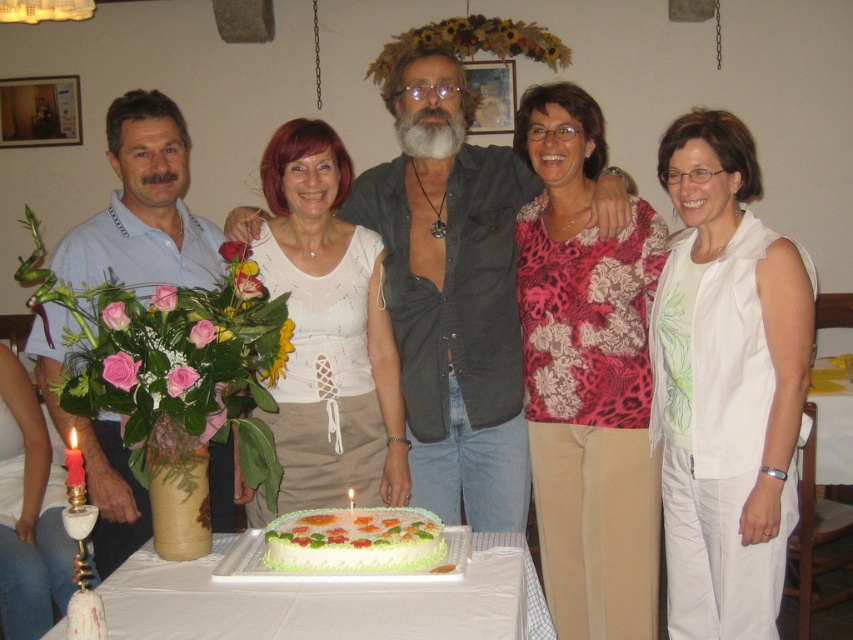
Question: Among these objects, which one is nearest to the camera?

Choices:
 (A) matte light blue polo shirt at left
 (B) dark gray shirt at center
 (C) white cotton vest at center

Answer: (A)

Question: Is white lace top at center below matte light blue polo shirt at left?

Choices:
 (A) yes
 (B) no

Answer: (B)

Question: Does white lace top at center have a smaller size compared to white frosted cake at center?

Choices:
 (A) no
 (B) yes

Answer: (A)

Question: Is floral print blouse at center further to the viewer compared to matte light blue polo shirt at left?

Choices:
 (A) yes
 (B) no

Answer: (A)

Question: Which point is farther to the camera?

Choices:
 (A) white cotton vest at center
 (B) white frosted cake at center

Answer: (A)

Question: Considering the real-world distances, which object is closest to the floral print blouse at center?

Choices:
 (A) matte light blue polo shirt at left
 (B) white frosted cake at center

Answer: (B)